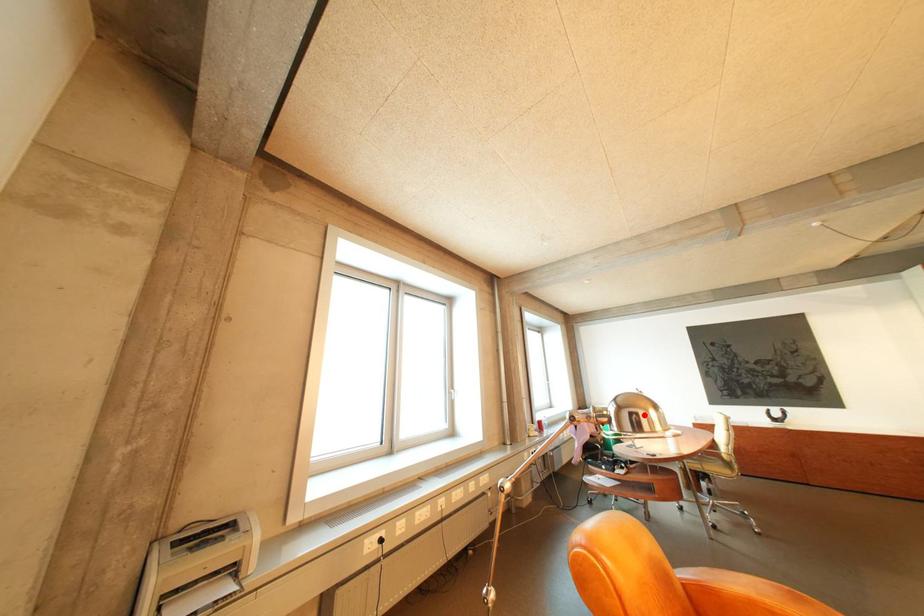
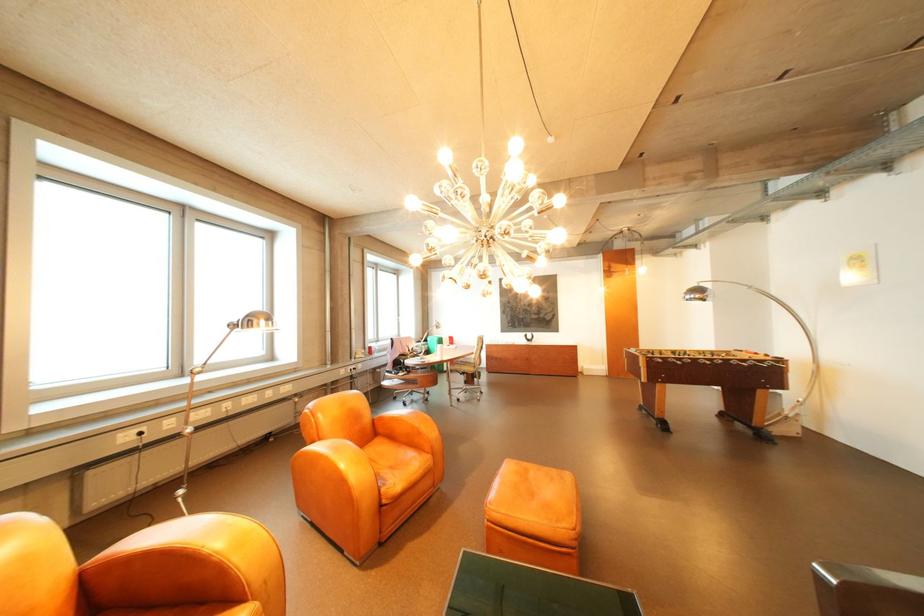
The point at the highlighted location is marked in the first image. Where is the corresponding point in the second image?

(262, 322)